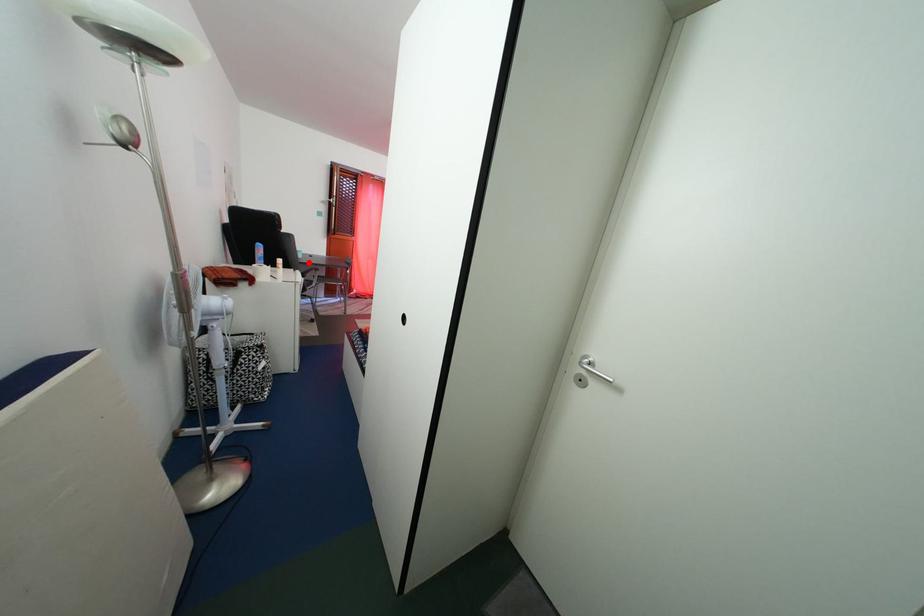
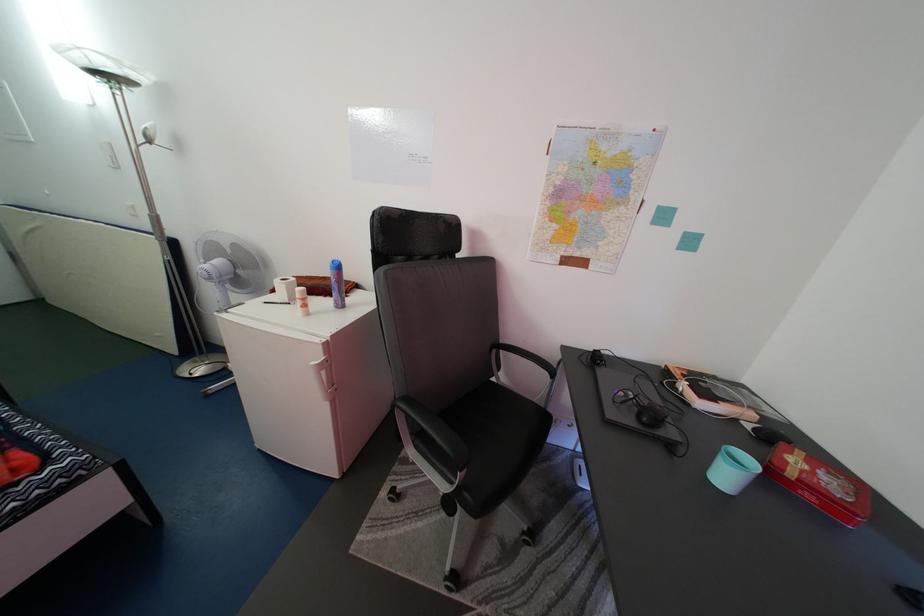
Where in the second image is the point corresponding to the highlighted location from the first image?

(735, 484)